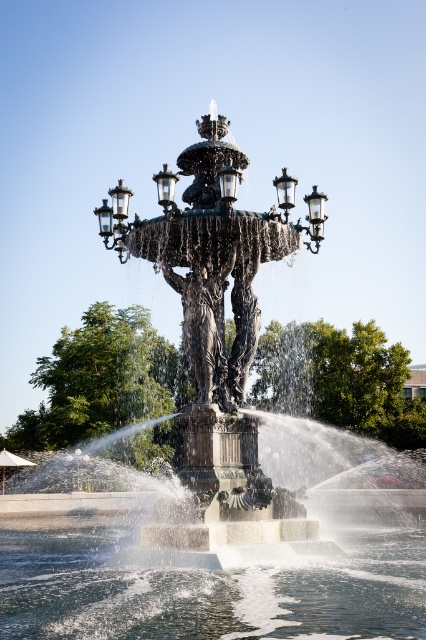
You are standing in the public square and see two points marked in the image. Which point is closer to you, point (411, 490) or point (112, 529)?

Point (112, 529) is closer to you because the description states that point (411, 490) is further away from the viewer compared to point (112, 529).

You are standing in the public square and want to take a photo of the clear water at center and the green leafy tree at center. Which object will appear closer to the camera in the photo?

The clear water at center will appear closer to the camera in the photo because it is shorter than the green leafy tree at center, so it is positioned in front of the tree.

You are a maintenance worker needing to water the green leafy tree at center. You have a hose that can reach up to 6 meters. Can you water the tree from the bronze statue at center without moving the hose nozzle?

The distance between the bronze statue at center and the green leafy tree at center is 6.55 meters. Since the hose can only reach up to 6 meters, you cannot water the tree from the bronze statue at center without moving the hose nozzle.